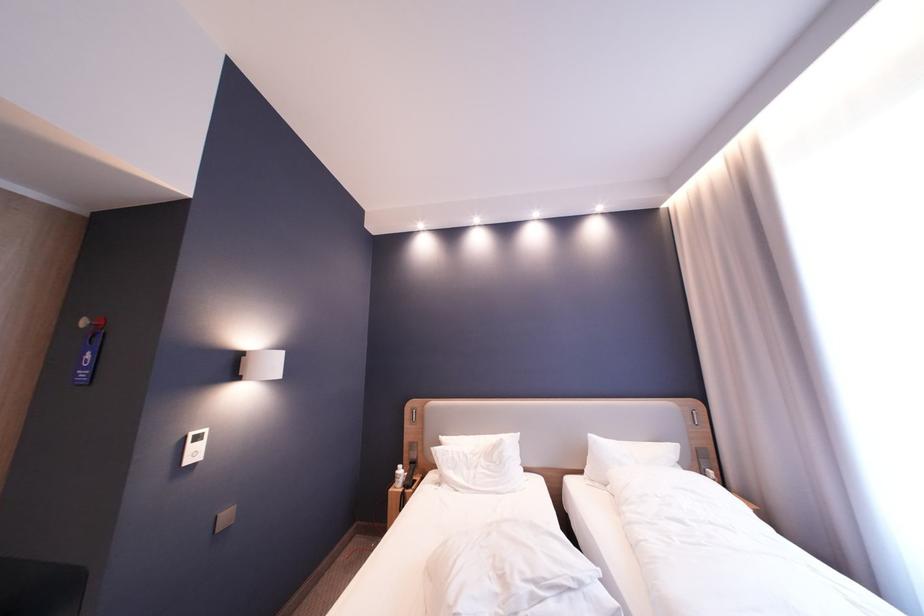
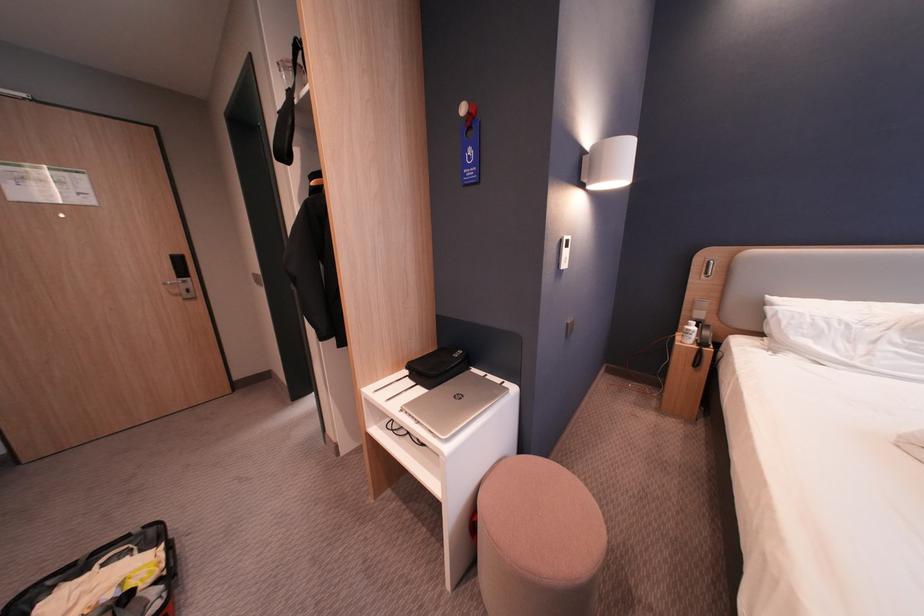
The point at [91,373] is marked in the first image. Where is the corresponding point in the second image?

(477, 172)